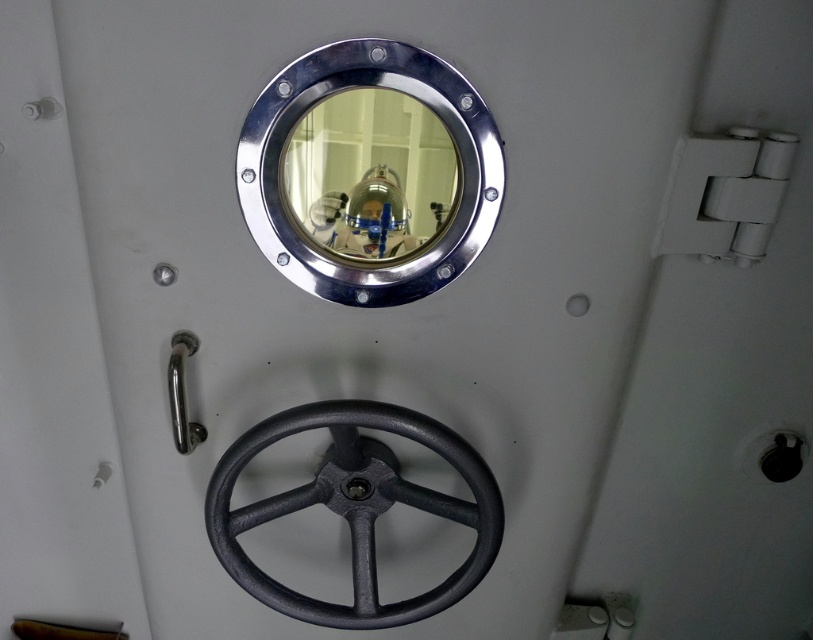
Question: Is polished metal porthole at upper center wider than black cast iron wheel at lower center?

Choices:
 (A) no
 (B) yes

Answer: (A)

Question: Which object appears closest to the camera in this image?

Choices:
 (A) black cast iron wheel at lower center
 (B) polished metal porthole at upper center

Answer: (B)

Question: Can you confirm if polished metal porthole at upper center is thinner than black cast iron wheel at lower center?

Choices:
 (A) no
 (B) yes

Answer: (B)

Question: Is the position of polished metal porthole at upper center more distant than that of black cast iron wheel at lower center?

Choices:
 (A) yes
 (B) no

Answer: (B)